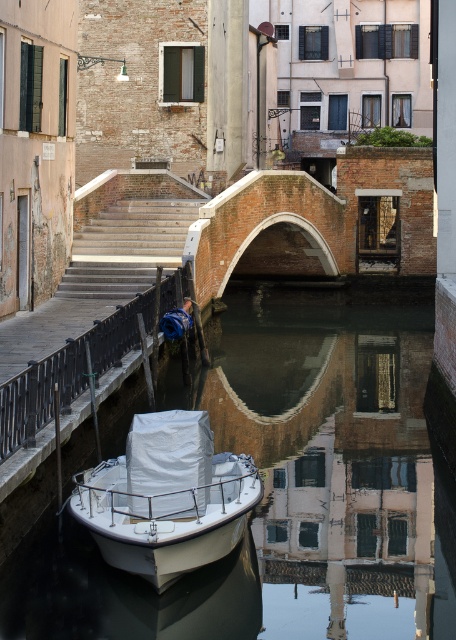
Question: Among these objects, which one is nearest to the camera?

Choices:
 (A) white plastic boat at lower center
 (B) white matte boat at lower center

Answer: (B)

Question: Which object is closer to the camera taking this photo?

Choices:
 (A) white matte boat at lower center
 (B) white plastic boat at lower center

Answer: (A)

Question: Does white plastic boat at lower center appear on the right side of smooth metal railing at lower left?

Choices:
 (A) yes
 (B) no

Answer: (A)

Question: Which of the following is the farthest from the observer?

Choices:
 (A) smooth metal railing at lower left
 (B) white matte boat at lower center

Answer: (A)

Question: Can you confirm if white matte boat at lower center is positioned to the left of smooth metal railing at lower left?

Choices:
 (A) yes
 (B) no

Answer: (B)

Question: Does white plastic boat at lower center appear under white matte boat at lower center?

Choices:
 (A) yes
 (B) no

Answer: (B)